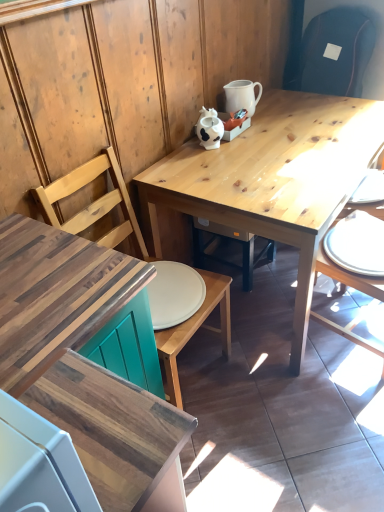
At what (x,y) coordinates should I click in order to perform the action: click on vacant space to the right of wooden chair at center, acting as the 2th chair starting from the right. Please return your answer as a coordinate pair (x, y). Looking at the image, I should click on (262, 392).